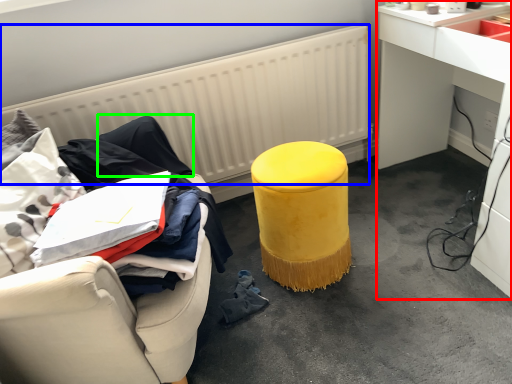
Question: Estimate the real-world distances between objects in this image. Which object is farther from desk (highlighted by a red box), radiator (highlighted by a blue box) or clothing (highlighted by a green box)?

Choices:
 (A) radiator
 (B) clothing

Answer: (B)